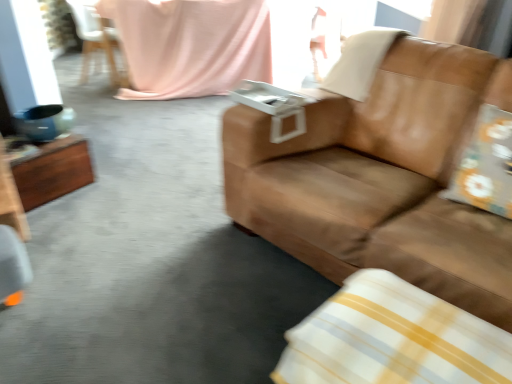
Identify the location of free space to the left of brown leather couch at center. This screenshot has width=512, height=384. (163, 281).